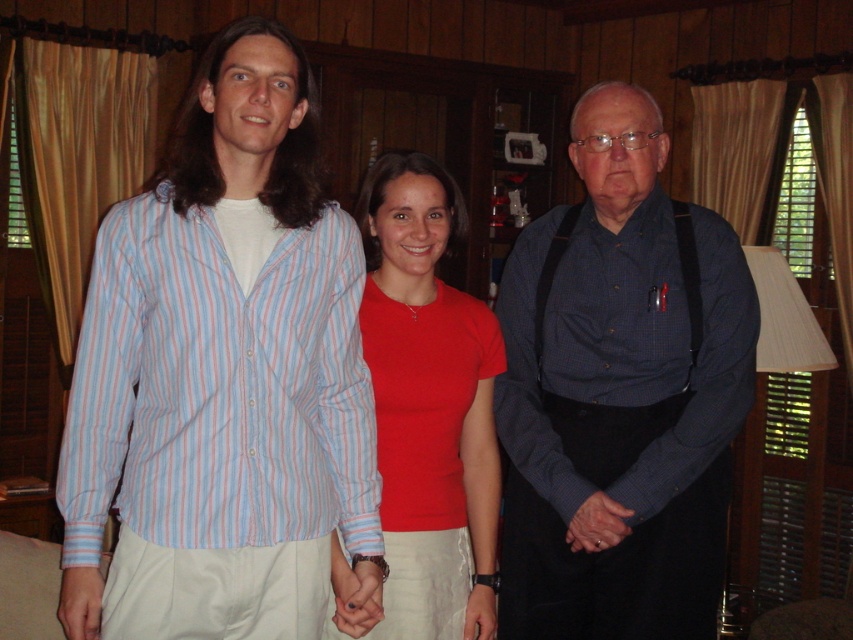
Does light blue striped shirt at left have a greater height compared to matte red shirt at center?

Yes.

Who is more forward, (91, 552) or (434, 536)?

Point (91, 552) is in front.

The image size is (853, 640). I want to click on light blue striped shirt at left, so click(224, 378).

Who is positioned more to the right, blue checkered shirt at center or matte red shirt at center?

From the viewer's perspective, blue checkered shirt at center appears more on the right side.

Is blue checkered shirt at center positioned behind matte red shirt at center?

Yes.

Locate an element on the screen. This screenshot has width=853, height=640. blue checkered shirt at center is located at coordinates (619, 396).

At what (x,y) coordinates should I click in order to perform the action: click on light blue striped shirt at left. Please return your answer as a coordinate pair (x, y). Image resolution: width=853 pixels, height=640 pixels. Looking at the image, I should click on (224, 378).

Does light blue striped shirt at left appear over blue checkered shirt at center?

Indeed, light blue striped shirt at left is positioned over blue checkered shirt at center.

This screenshot has height=640, width=853. In order to click on light blue striped shirt at left in this screenshot , I will do `click(224, 378)`.

The image size is (853, 640). I want to click on light blue striped shirt at left, so click(224, 378).